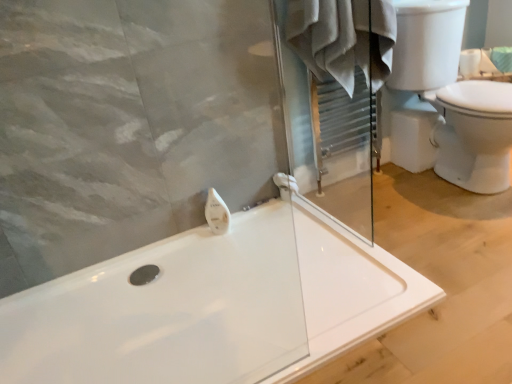
Where is `vacant area to the right of white glossy soap dispenser at upper center`? The image size is (512, 384). vacant area to the right of white glossy soap dispenser at upper center is located at coordinates (259, 223).